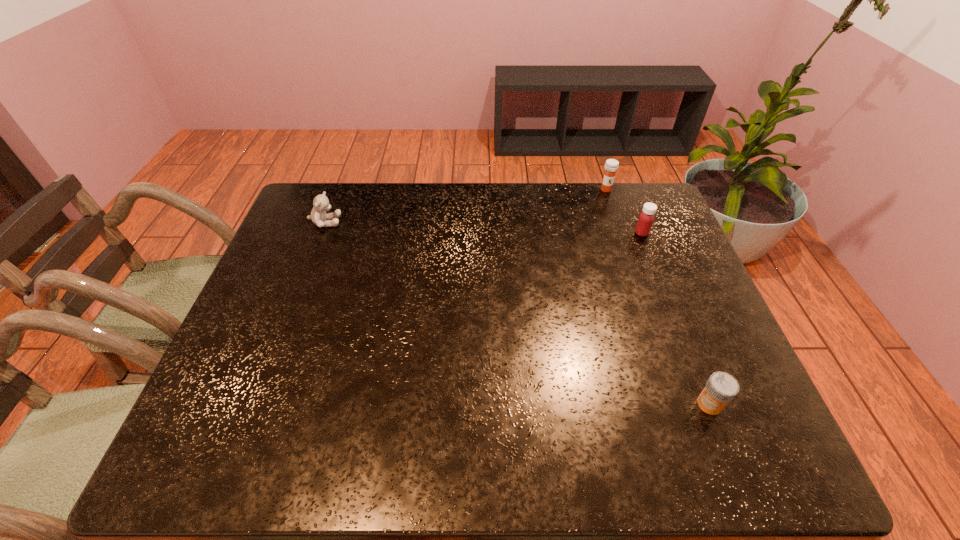
What are the coordinates of `free space at the right edge` in the screenshot? It's located at (693, 290).

This screenshot has width=960, height=540. In the image, there is a desktop. What are the coordinates of `vacant region at the far left corner` in the screenshot? It's located at (325, 191).

Where is `vacant space at the far right corner`? The image size is (960, 540). vacant space at the far right corner is located at coordinates (619, 185).

The image size is (960, 540). What are the coordinates of `vacant space that's between the nearest medicine and the farthest medicine` in the screenshot? It's located at (658, 297).

The image size is (960, 540). What are the coordinates of `vacant point located between the nearest object and the leftmost object` in the screenshot? It's located at (517, 313).

This screenshot has width=960, height=540. I want to click on vacant space that's between the shortest object and the second nearest medicine, so click(676, 319).

Where is `free space between the shortest object and the second farthest medicine`? This screenshot has width=960, height=540. free space between the shortest object and the second farthest medicine is located at coordinates (676, 319).

At what (x,y) coordinates should I click in order to perform the action: click on empty location between the teddy bear and the leftmost medicine. Please return your answer as a coordinate pair (x, y). Looking at the image, I should click on (466, 206).

I want to click on empty location between the second nearest medicine and the shortest object, so click(x=676, y=319).

This screenshot has height=540, width=960. What are the coordinates of `free spot between the leftmost object and the second nearest medicine` in the screenshot? It's located at (484, 227).